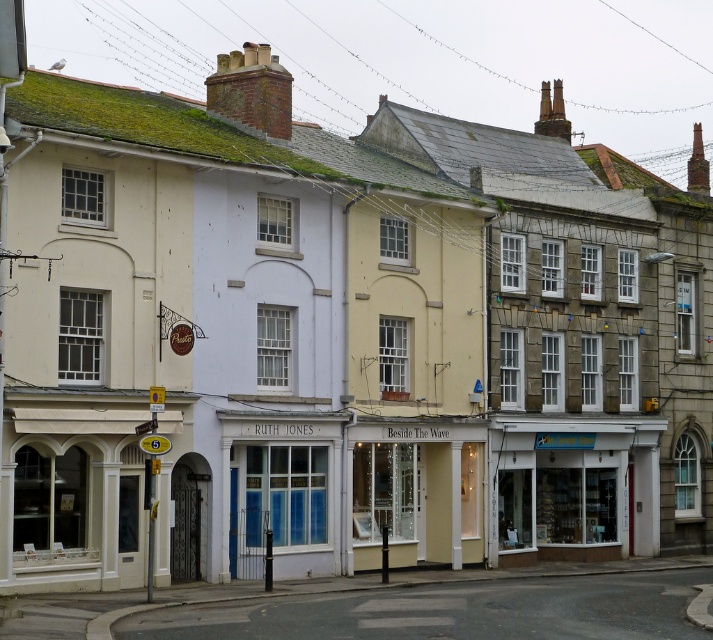
Question: Which object appears closest to the camera in this image?

Choices:
 (A) white glass storefront at lower right
 (B) white glass storefront at center

Answer: (B)

Question: Is white glass storefront at lower right to the left of white glass storefront at center from the viewer's perspective?

Choices:
 (A) yes
 (B) no

Answer: (B)

Question: Is white glass storefront at lower right to the right of white glass storefront at center from the viewer's perspective?

Choices:
 (A) yes
 (B) no

Answer: (A)

Question: Is white glass storefront at lower right further to camera compared to white glass storefront at center?

Choices:
 (A) no
 (B) yes

Answer: (B)

Question: Which point is closer to the camera?

Choices:
 (A) (620, 493)
 (B) (421, 490)

Answer: (B)